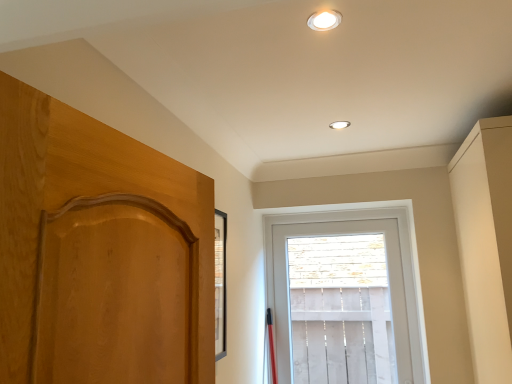
Question: Would you say white glossy light fixture at upper center, acting as the first lighting starting from the right, is inside or outside white wooden window at center?

Choices:
 (A) inside
 (B) outside

Answer: (B)

Question: Considering the positions of white glossy light fixture at upper center, which ranks as the second lighting in top-to-bottom order, and white wooden window at center in the image, is white glossy light fixture at upper center, which ranks as the second lighting in top-to-bottom order, taller or shorter than white wooden window at center?

Choices:
 (A) tall
 (B) short

Answer: (B)

Question: Based on their relative distances, which object is nearer to the white wooden window at center?

Choices:
 (A) white glossy light fixture at upper center, which ranks as the second lighting in top-to-bottom order
 (B) matte beige dresser at right
 (C) white glossy recessed light at upper center, the 1th lighting positioned from the front

Answer: (B)

Question: Considering the real-world distances, which object is closest to the white wooden window at center?

Choices:
 (A) matte beige dresser at right
 (B) white glossy recessed light at upper center, which ranks as the 1th lighting in left-to-right order
 (C) white glossy light fixture at upper center, the second lighting positioned from the left

Answer: (A)